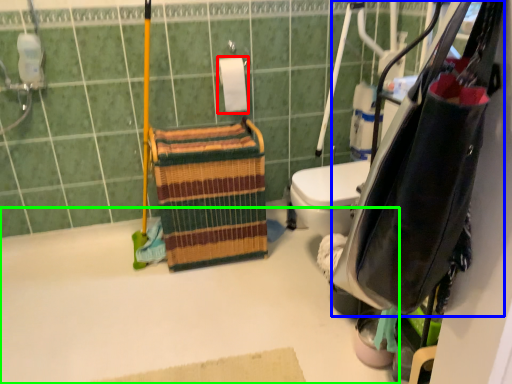
Question: Considering the real-world distances, which object is closest to toilet paper (highlighted by a red box)? bag (highlighted by a blue box) or bath (highlighted by a green box).

Choices:
 (A) bag
 (B) bath

Answer: (B)